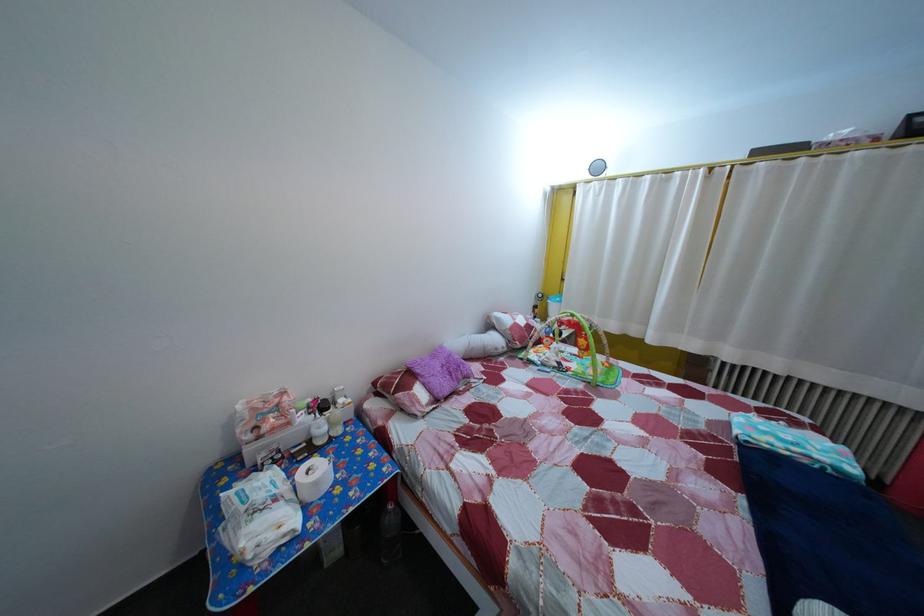
The location [312,479] corresponds to which object?

It refers to a white tissue roll.